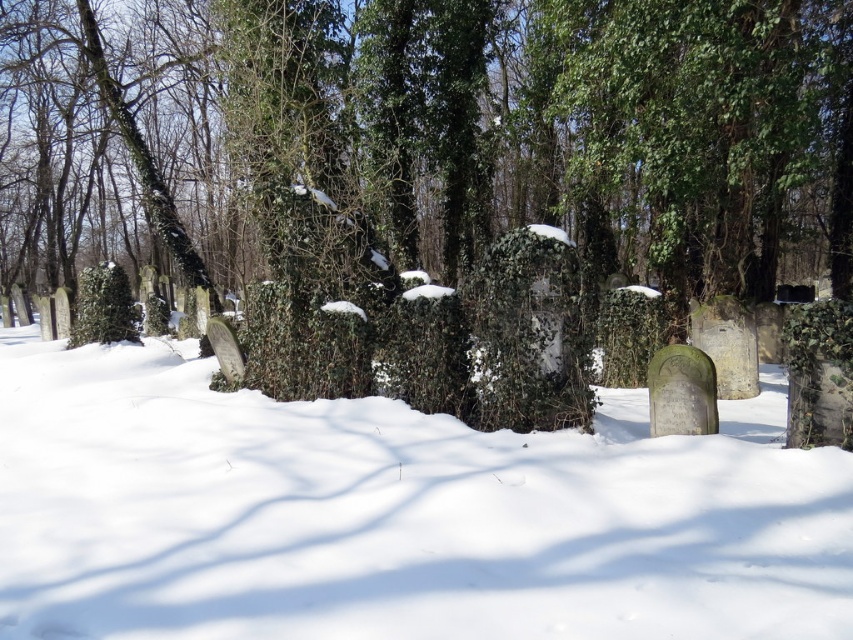
You are standing at the entrance of the cemetery and want to walk towards the point labeled as point [630,49]. However, there is an obstacle located at point [706,349]. Will you encounter this obstacle on your path?

Yes, you will encounter the obstacle at point [706,349] because point [630,49] is in front of it, meaning the obstacle is along your path towards the target point.